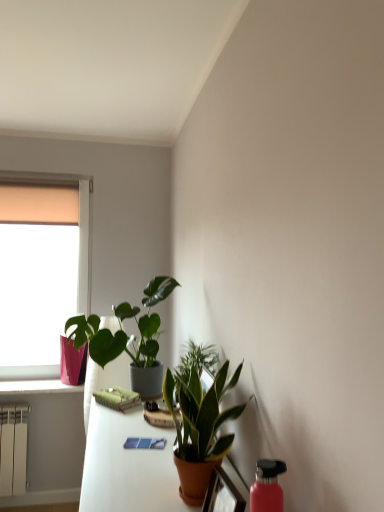
Question: Considering the relative sizes of terracotta ceramic table at center and matte orange pot at lower center in the image provided, is terracotta ceramic table at center thinner than matte orange pot at lower center?

Choices:
 (A) no
 (B) yes

Answer: (A)

Question: Considering the relative sizes of terracotta ceramic table at center and matte orange pot at lower center in the image provided, is terracotta ceramic table at center taller than matte orange pot at lower center?

Choices:
 (A) no
 (B) yes

Answer: (B)

Question: Does terracotta ceramic table at center lie in front of matte orange pot at lower center?

Choices:
 (A) yes
 (B) no

Answer: (B)

Question: Is matte orange pot at lower center located within terracotta ceramic table at center?

Choices:
 (A) yes
 (B) no

Answer: (B)

Question: Is terracotta ceramic table at center bigger than matte orange pot at lower center?

Choices:
 (A) no
 (B) yes

Answer: (B)

Question: In terms of width, does terracotta ceramic table at center look wider or thinner when compared to matte pink vase at left?

Choices:
 (A) thin
 (B) wide

Answer: (B)

Question: Is terracotta ceramic table at center situated inside matte pink vase at left or outside?

Choices:
 (A) inside
 (B) outside

Answer: (B)

Question: Is terracotta ceramic table at center taller or shorter than matte pink vase at left?

Choices:
 (A) tall
 (B) short

Answer: (B)

Question: From a real-world perspective, is terracotta ceramic table at center above or below matte pink vase at left?

Choices:
 (A) below
 (B) above

Answer: (A)

Question: Is matte pink vase at left to the left or to the right of green glossy houseplant at center, the second houseplant from the left, in the image?

Choices:
 (A) left
 (B) right

Answer: (A)

Question: Considering the positions of point (14, 271) and point (195, 451), is point (14, 271) closer or farther from the camera than point (195, 451)?

Choices:
 (A) closer
 (B) farther

Answer: (B)

Question: In terms of height, does matte pink vase at left look taller or shorter compared to green glossy houseplant at center, marked as the 2th houseplant in a back-to-front arrangement?

Choices:
 (A) short
 (B) tall

Answer: (B)

Question: In terms of size, does matte pink vase at left appear bigger or smaller than green glossy houseplant at center, the 1th houseplant positioned from the right?

Choices:
 (A) small
 (B) big

Answer: (B)

Question: Considering their positions, is pink glossy flowerpot at lower left located in front of or behind orange fabric curtain at upper left?

Choices:
 (A) front
 (B) behind

Answer: (A)

Question: Is pink glossy flowerpot at lower left inside or outside of orange fabric curtain at upper left?

Choices:
 (A) inside
 (B) outside

Answer: (B)